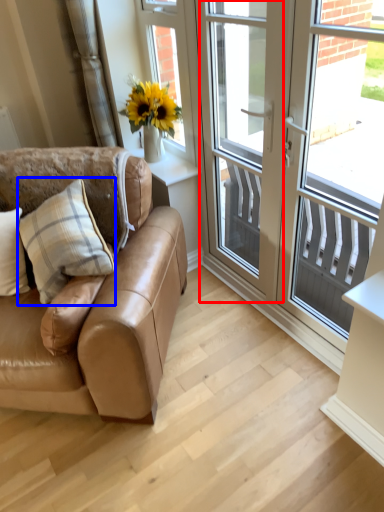
Question: Which object appears farthest to the camera in this image, screen door (highlighted by a red box) or pillow (highlighted by a blue box)?

Choices:
 (A) screen door
 (B) pillow

Answer: (B)